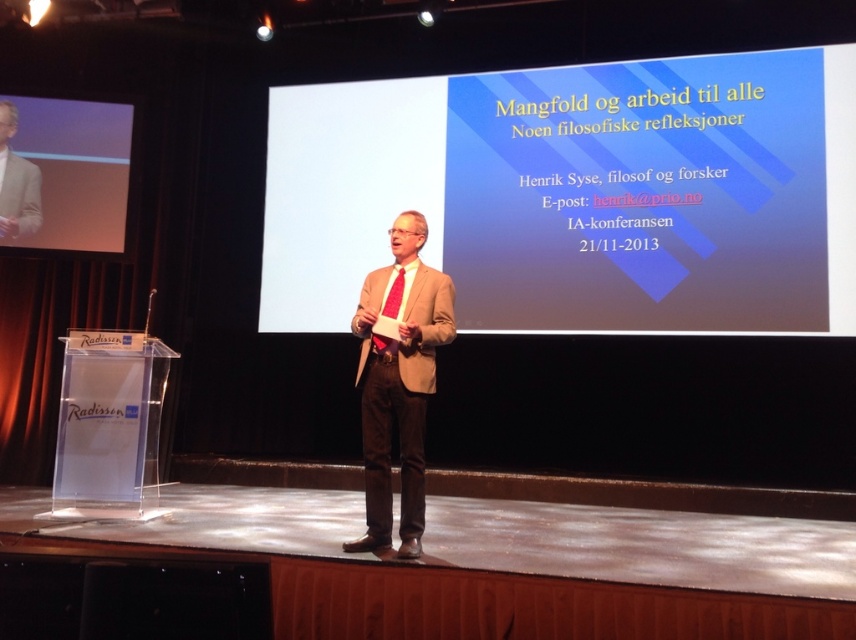
Can you confirm if matte black screen at upper left is positioned above matte red tie at center?

Yes, matte black screen at upper left is above matte red tie at center.

Is point (10, 243) less distant than point (391, 282)?

No, it is behind (391, 282).

Where is `matte black screen at upper left`? Image resolution: width=856 pixels, height=640 pixels. matte black screen at upper left is located at coordinates (63, 173).

Who is more distant from viewer, (831, 120) or (397, 276)?

The point (831, 120) is behind.

Does blue gradient screen at center have a greater width compared to matte red tie at center?

Indeed, blue gradient screen at center has a greater width compared to matte red tie at center.

The image size is (856, 640). What do you see at coordinates (578, 193) in the screenshot?
I see `blue gradient screen at center` at bounding box center [578, 193].

At what (x,y) coordinates should I click in order to perform the action: click on blue gradient screen at center. Please return your answer as a coordinate pair (x, y). Looking at the image, I should click on (578, 193).

Can you confirm if matte brown suit at center is thinner than matte red tie at center?

In fact, matte brown suit at center might be wider than matte red tie at center.

Does matte brown suit at center appear on the right side of matte red tie at center?

Yes, matte brown suit at center is to the right of matte red tie at center.

Does point (369, 474) come behind point (395, 298)?

That is False.

The image size is (856, 640). Find the location of `matte brown suit at center`. matte brown suit at center is located at coordinates (397, 381).